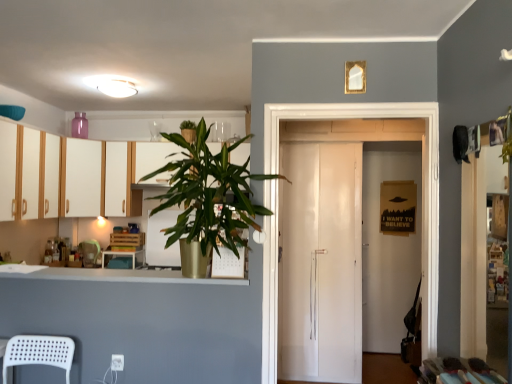
Question: From a real-world perspective, does matte wood table at center stand above white wood cabinets at left, acting as the 2th cabinetry starting from the back?

Choices:
 (A) no
 (B) yes

Answer: (A)

Question: Does matte wood table at center lie in front of white wood cabinets at left, acting as the first cabinetry starting from the front?

Choices:
 (A) yes
 (B) no

Answer: (B)

Question: Is matte wood table at center further to camera compared to white wood cabinets at left, acting as the first cabinetry starting from the front?

Choices:
 (A) yes
 (B) no

Answer: (A)

Question: Considering the relative sizes of matte wood table at center and white wood cabinets at left, the first cabinetry positioned from the right, in the image provided, is matte wood table at center thinner than white wood cabinets at left, the first cabinetry positioned from the right,?

Choices:
 (A) yes
 (B) no

Answer: (A)

Question: Is matte wood table at center turned away from white wood cabinets at left, the first cabinetry positioned from the right?

Choices:
 (A) yes
 (B) no

Answer: (B)

Question: Are matte wood table at center and white wood cabinets at left, which is the second cabinetry from left to right, making contact?

Choices:
 (A) yes
 (B) no

Answer: (B)

Question: From a real-world perspective, is green leafy plant at upper center positioned over matte white cabinet at upper left, the first cabinetry viewed from the back, based on gravity?

Choices:
 (A) no
 (B) yes

Answer: (A)

Question: Can you confirm if green leafy plant at upper center is positioned to the right of matte white cabinet at upper left, the second cabinetry when ordered from front to back?

Choices:
 (A) no
 (B) yes

Answer: (B)

Question: Is green leafy plant at upper center thinner than matte white cabinet at upper left, which ranks as the first cabinetry in left-to-right order?

Choices:
 (A) no
 (B) yes

Answer: (A)

Question: Is green leafy plant at upper center aimed at matte white cabinet at upper left, the second cabinetry when ordered from front to back?

Choices:
 (A) yes
 (B) no

Answer: (B)

Question: From a real-world perspective, is green leafy plant at upper center beneath matte white cabinet at upper left, the second cabinetry when ordered from front to back?

Choices:
 (A) yes
 (B) no

Answer: (A)

Question: Is the depth of green leafy plant at upper center greater than that of matte white cabinet at upper left, the first cabinetry viewed from the back?

Choices:
 (A) no
 (B) yes

Answer: (A)

Question: Are matte wood table at center and white glossy refrigerator at center beside each other?

Choices:
 (A) yes
 (B) no

Answer: (B)